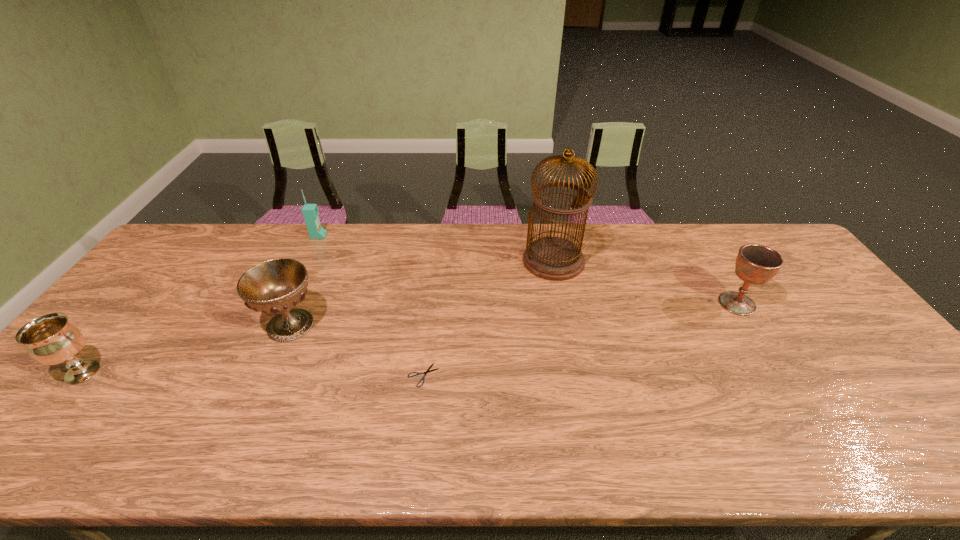
Locate an element on the screen. The height and width of the screenshot is (540, 960). vacant region located 0.210m on the keypad of the cellular telephone is located at coordinates (386, 236).

The width and height of the screenshot is (960, 540). In order to click on vacant area located 0.390m on the left of the rightmost chalice in this screenshot , I will do `click(585, 303)`.

The height and width of the screenshot is (540, 960). I want to click on free spot located on the right of the second chalice from right to left, so click(x=372, y=325).

Locate an element on the screen. The image size is (960, 540). vacant region located 0.160m on the back of the leftmost chalice is located at coordinates (132, 313).

Image resolution: width=960 pixels, height=540 pixels. I want to click on free space located on the front of the shears, so click(414, 459).

Locate an element on the screen. The height and width of the screenshot is (540, 960). birdcage that is at the far edge is located at coordinates (553, 258).

Where is `cellular telephone at the far edge`? This screenshot has height=540, width=960. cellular telephone at the far edge is located at coordinates (310, 212).

The height and width of the screenshot is (540, 960). Identify the location of object that is positioned at the left edge. (49, 339).

This screenshot has width=960, height=540. In the image, there is a desktop. Find the location of `vacant space at the far edge`. vacant space at the far edge is located at coordinates (624, 266).

At what (x,y) coordinates should I click in order to perform the action: click on free location at the near edge. Please return your answer as a coordinate pair (x, y). This screenshot has width=960, height=540. Looking at the image, I should click on (711, 439).